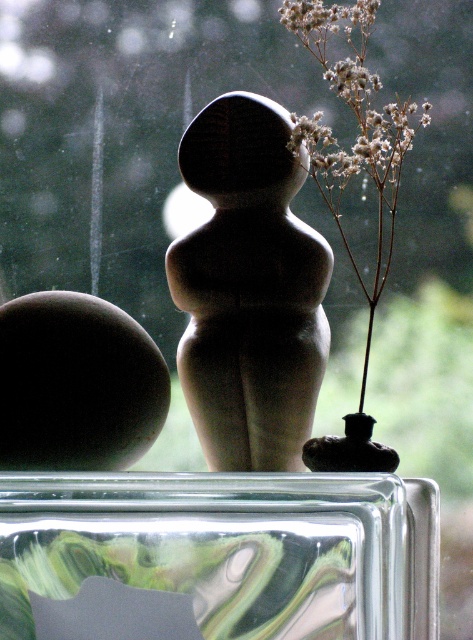
Question: Where is marbled glass window sill at center located in relation to white fluffy flowers at upper right in the image?

Choices:
 (A) right
 (B) left

Answer: (B)

Question: Is marbled glass window sill at center above white fluffy flowers at upper right?

Choices:
 (A) yes
 (B) no

Answer: (B)

Question: Can you confirm if marbled glass window sill at center is wider than white fluffy flowers at upper right?

Choices:
 (A) yes
 (B) no

Answer: (A)

Question: Which point appears closest to the camera in this image?

Choices:
 (A) (386, 161)
 (B) (71, 625)

Answer: (B)